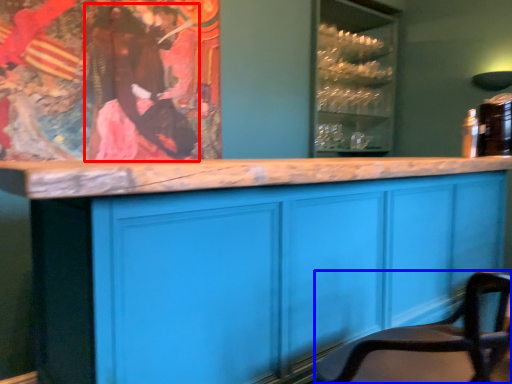
Question: Which object appears closest to the camera in this image, person (highlighted by a red box) or chair (highlighted by a blue box)?

Choices:
 (A) person
 (B) chair

Answer: (B)